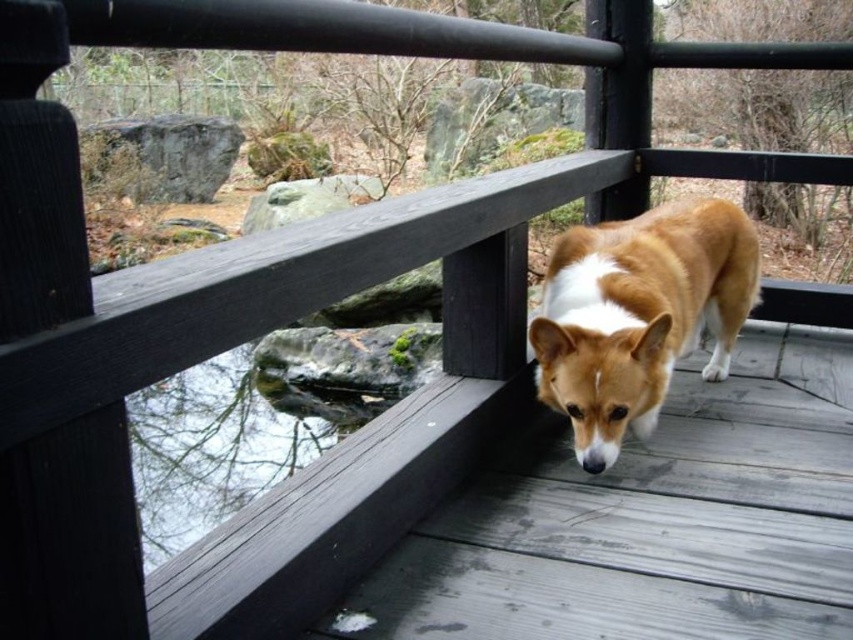
Who is more distant from viewer, (527, 432) or (599, 259)?

Point (527, 432)

Based on the photo, who is more forward, (463, 595) or (695, 289)?

Positioned in front is point (463, 595).

Find the location of a particular element. The width and height of the screenshot is (853, 640). wooden deck at center is located at coordinates (648, 520).